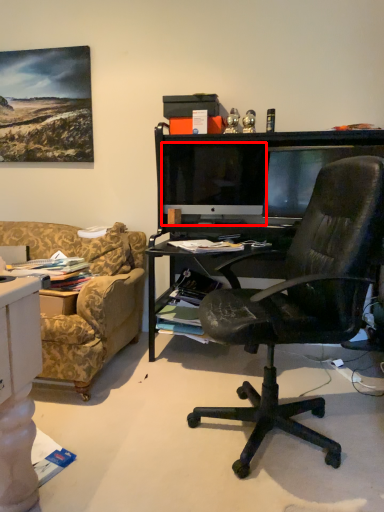
Question: Observing the image, what is the correct spatial positioning of computer monitor (annotated by the red box) in reference to computer monitor?

Choices:
 (A) left
 (B) right

Answer: (A)